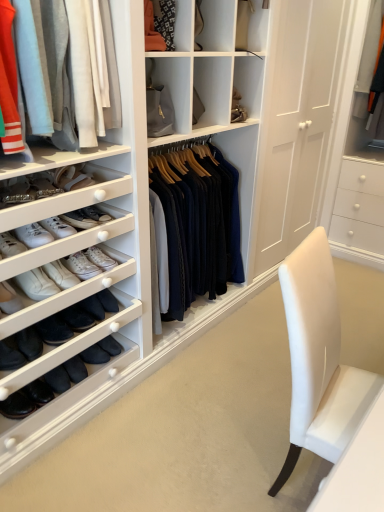
Question: Considering the relative sizes of light gray cotton pants at upper left and white leather sneakers at left in the image provided, is light gray cotton pants at upper left taller than white leather sneakers at left?

Choices:
 (A) yes
 (B) no

Answer: (A)

Question: Is light gray cotton pants at upper left bigger than white leather sneakers at left?

Choices:
 (A) no
 (B) yes

Answer: (B)

Question: From a real-world perspective, is light gray cotton pants at upper left on top of white leather sneakers at left?

Choices:
 (A) yes
 (B) no

Answer: (A)

Question: Is the position of light gray cotton pants at upper left less distant than that of white leather sneakers at left?

Choices:
 (A) yes
 (B) no

Answer: (A)

Question: Is light gray cotton pants at upper left aimed at white leather sneakers at left?

Choices:
 (A) yes
 (B) no

Answer: (B)

Question: From the image's perspective, is white leather sneakers at left located above or below light gray cotton pants at upper left?

Choices:
 (A) below
 (B) above

Answer: (A)

Question: Choose the correct answer: Is white leather sneakers at left inside light gray cotton pants at upper left or outside it?

Choices:
 (A) inside
 (B) outside

Answer: (B)

Question: Relative to light gray cotton pants at upper left, is white leather sneakers at left in front or behind?

Choices:
 (A) behind
 (B) front

Answer: (A)

Question: Visually, is white leather sneakers at left positioned to the left or to the right of light gray cotton pants at upper left?

Choices:
 (A) right
 (B) left

Answer: (B)

Question: From a real-world perspective, is light gray cotton pants at upper left physically located above or below white leather sneakers at left?

Choices:
 (A) above
 (B) below

Answer: (A)

Question: In terms of width, does light gray cotton pants at upper left look wider or thinner when compared to white leather sneakers at left?

Choices:
 (A) wide
 (B) thin

Answer: (A)

Question: Considering the positions of light gray cotton pants at upper left and white leather sneakers at left in the image, is light gray cotton pants at upper left bigger or smaller than white leather sneakers at left?

Choices:
 (A) big
 (B) small

Answer: (A)

Question: In terms of height, does light gray cotton pants at upper left look taller or shorter compared to white leather sneakers at left?

Choices:
 (A) short
 (B) tall

Answer: (B)

Question: Is white leather sneakers at left spatially inside matte orange fabric at upper center, or outside of it?

Choices:
 (A) outside
 (B) inside

Answer: (A)

Question: Considering the positions of white leather sneakers at left and matte orange fabric at upper center in the image, is white leather sneakers at left bigger or smaller than matte orange fabric at upper center?

Choices:
 (A) big
 (B) small

Answer: (B)